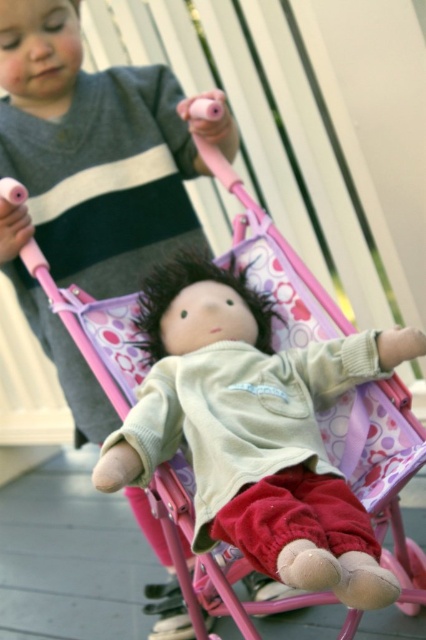
Question: Is velvety beige doll at center to the left of matte gray shirt at upper left from the viewer's perspective?

Choices:
 (A) no
 (B) yes

Answer: (A)

Question: Which object is closer to the camera taking this photo?

Choices:
 (A) velvety beige doll at center
 (B) matte gray shirt at upper left

Answer: (A)

Question: Does velvety beige doll at center appear under matte gray shirt at upper left?

Choices:
 (A) no
 (B) yes

Answer: (B)

Question: Is velvety beige doll at center in front of matte gray shirt at upper left?

Choices:
 (A) no
 (B) yes

Answer: (B)

Question: Among these objects, which one is nearest to the camera?

Choices:
 (A) velvety beige doll at center
 (B) matte gray shirt at upper left

Answer: (A)

Question: Among these points, which one is farthest from the camera?

Choices:
 (A) (336, 518)
 (B) (94, 432)

Answer: (B)